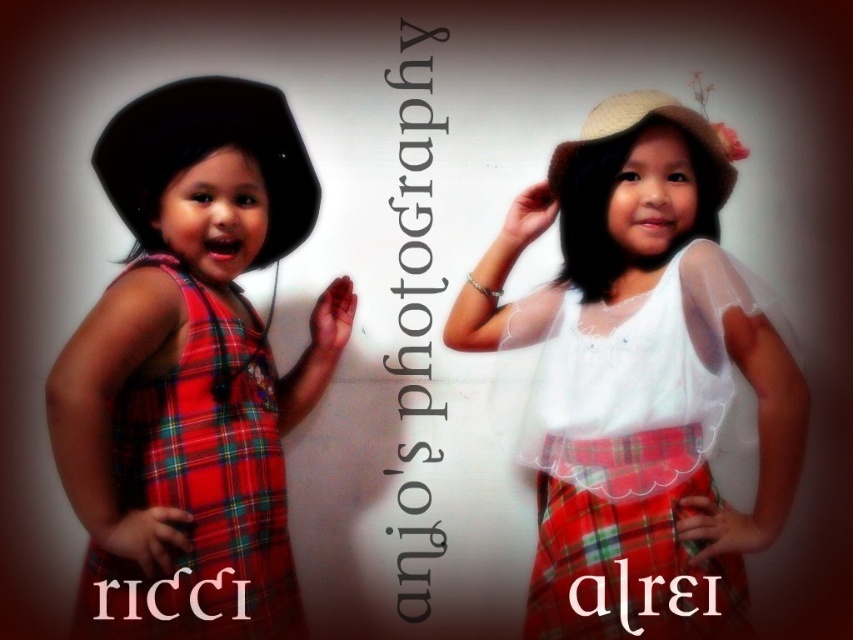
Question: Which of the following is the farthest from the observer?

Choices:
 (A) matte plaid dress at left
 (B) red plaid kilt at lower right
 (C) matte white blouse at center

Answer: (C)

Question: Which of the following is the closest to the observer?

Choices:
 (A) (117, 538)
 (B) (602, 592)

Answer: (A)

Question: Which point is farther to the camera?

Choices:
 (A) (718, 616)
 (B) (271, 611)
 (C) (515, 236)

Answer: (C)

Question: Is the position of matte plaid dress at left less distant than that of red plaid kilt at lower right?

Choices:
 (A) no
 (B) yes

Answer: (B)

Question: Considering the relative positions of matte white blouse at center and red plaid kilt at lower right in the image provided, where is matte white blouse at center located with respect to red plaid kilt at lower right?

Choices:
 (A) below
 (B) above

Answer: (B)

Question: Can you confirm if matte white blouse at center is positioned above red plaid kilt at lower right?

Choices:
 (A) no
 (B) yes

Answer: (B)